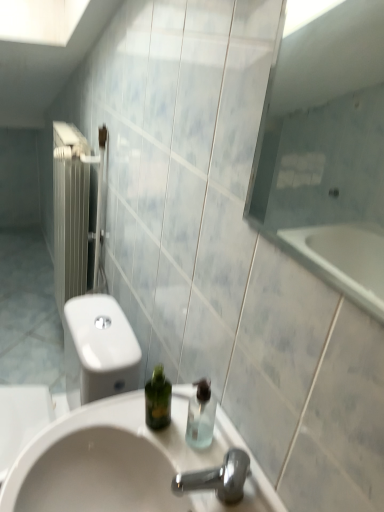
Question: Is white glossy sink at center at the back of transparent glass shower at right?

Choices:
 (A) no
 (B) yes

Answer: (A)

Question: Is transparent glass shower at right not near white glossy sink at center?

Choices:
 (A) no
 (B) yes

Answer: (B)

Question: Can white glossy sink at center be found inside transparent glass shower at right?

Choices:
 (A) yes
 (B) no

Answer: (B)

Question: Is transparent glass shower at right closer to camera compared to white glossy sink at center?

Choices:
 (A) no
 (B) yes

Answer: (B)

Question: Is transparent glass shower at right taller than white glossy sink at center?

Choices:
 (A) no
 (B) yes

Answer: (A)

Question: Can you confirm if transparent glass shower at right is thinner than white glossy sink at center?

Choices:
 (A) yes
 (B) no

Answer: (A)

Question: From the image's perspective, is transparent plastic soap dispenser at center under white glossy sink at center?

Choices:
 (A) no
 (B) yes

Answer: (A)

Question: Considering the relative sizes of transparent plastic soap dispenser at center and white glossy sink at center in the image provided, is transparent plastic soap dispenser at center smaller than white glossy sink at center?

Choices:
 (A) no
 (B) yes

Answer: (B)

Question: Can you confirm if transparent plastic soap dispenser at center is thinner than white glossy sink at center?

Choices:
 (A) yes
 (B) no

Answer: (A)

Question: Can you confirm if transparent plastic soap dispenser at center is wider than white glossy sink at center?

Choices:
 (A) yes
 (B) no

Answer: (B)

Question: Is transparent plastic soap dispenser at center shorter than white glossy sink at center?

Choices:
 (A) no
 (B) yes

Answer: (B)

Question: Considering the relative positions of transparent plastic soap dispenser at center and white glossy sink at center in the image provided, is transparent plastic soap dispenser at center behind white glossy sink at center?

Choices:
 (A) yes
 (B) no

Answer: (A)

Question: Is white glossy sink at center not close to transparent glass shower at right?

Choices:
 (A) yes
 (B) no

Answer: (A)